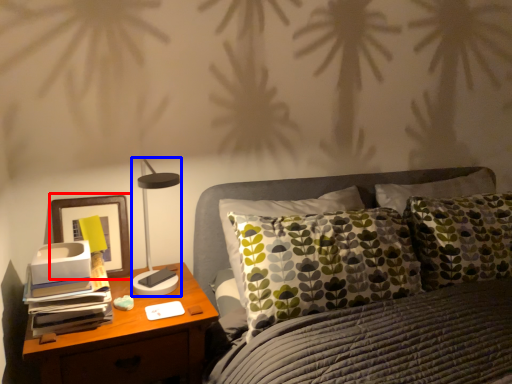
Question: Among these objects, which one is farthest to the camera, picture frame (highlighted by a red box) or table lamp (highlighted by a blue box)?

Choices:
 (A) picture frame
 (B) table lamp

Answer: (A)